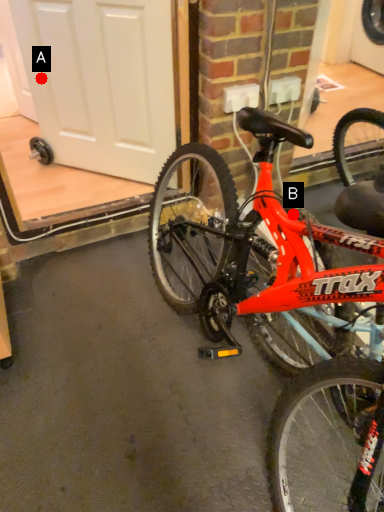
Question: Two points are circled on the image, labeled by A and B beside each circle. Which of the following is the farthest from the observer?

Choices:
 (A) A is further
 (B) B is further

Answer: (A)